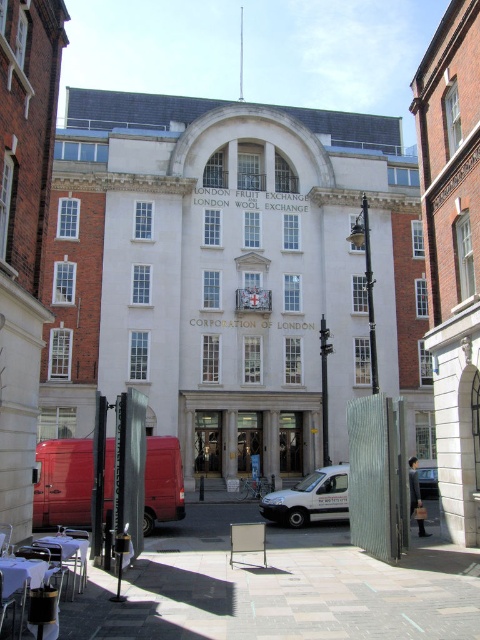
You are standing at the entrance of the London Fruit Exchange and want to find the wooden table at lower left. Based on the coordinates provided in the Objects Description, in which direction should you look to locate it?

The wooden table at lower left is located at point (22, 577), which corresponds to the lower left area of the image. Since you are at the entrance facing the building, you should look to your left and downward to locate it.